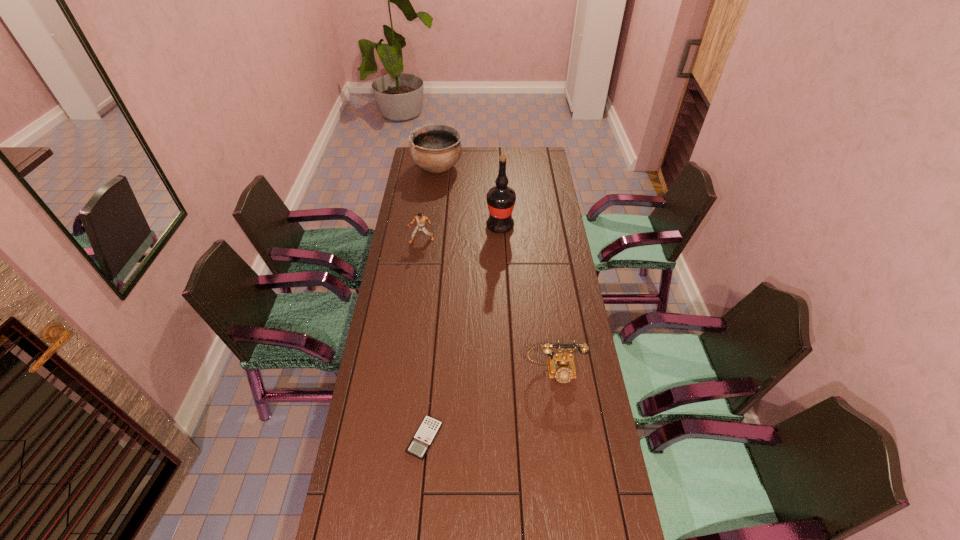
Where is `the tallest object`? The width and height of the screenshot is (960, 540). the tallest object is located at coordinates (501, 199).

Locate an element on the screen. the fourth shortest object is located at coordinates (435, 148).

The height and width of the screenshot is (540, 960). I want to click on the farthest object, so click(x=435, y=148).

Identify the location of puncher. This screenshot has width=960, height=540. (421, 220).

Locate an element on the screen. This screenshot has width=960, height=540. the second nearest object is located at coordinates (561, 366).

You are a GUI agent. You are given a task and a screenshot of the screen. Output one action in this format:
    pyautogui.click(x=<x>, y=<y>)
    Task: Click on the nearest object
    
    Given the screenshot: What is the action you would take?
    pyautogui.click(x=429, y=428)

Where is `the shortest object`? the shortest object is located at coordinates (429, 428).

Find the location of a particular element. This screenshot has height=540, width=960. vacant space located 0.100m on the back of the wine bottle is located at coordinates (499, 205).

The height and width of the screenshot is (540, 960). Identify the location of free location located 0.100m on the front of the fourth shortest object. (435, 193).

Where is `vacant position located on the front-facing side of the puncher`? vacant position located on the front-facing side of the puncher is located at coordinates (420, 254).